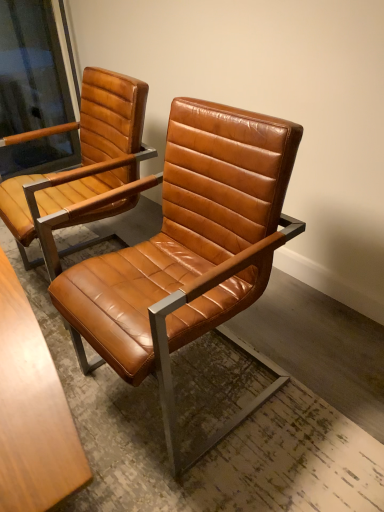
Locate an element on the screen. This screenshot has height=512, width=384. matte brown leather chair arm at upper left is located at coordinates (31, 69).

What is the approximate height of cognac leather chair at center, which is counted as the 1th chair, starting from the left?

cognac leather chair at center, which is counted as the 1th chair, starting from the left, is 34.24 inches tall.

Identify the location of cognac leather chair at center, positioned as the second chair in right-to-left order. This screenshot has height=512, width=384. (81, 155).

This screenshot has height=512, width=384. Describe the element at coordinates (188, 248) in the screenshot. I see `cognac leather chair at center, which is counted as the 2th chair, starting from the left` at that location.

What are the coordinates of `matte brown leather chair arm at upper left` in the screenshot? It's located at (31, 69).

Between point (109, 320) and point (11, 19), which one is positioned behind?

Positioned behind is point (11, 19).

In terms of height, does cognac leather chair at center, which is counted as the 2th chair, starting from the left, look taller or shorter compared to matte brown leather chair arm at upper left?

cognac leather chair at center, which is counted as the 2th chair, starting from the left, is taller than matte brown leather chair arm at upper left.

Relative to matte brown leather chair arm at upper left, is cognac leather chair at center, positioned as the first chair in right-to-left order, in front or behind?

Visually, cognac leather chair at center, positioned as the first chair in right-to-left order, is located in front of matte brown leather chair arm at upper left.

Which is more to the left, cognac leather chair at center, positioned as the first chair in right-to-left order, or matte brown leather chair arm at upper left?

matte brown leather chair arm at upper left.

From a real-world perspective, is matte brown leather chair arm at upper left positioned above or below cognac leather chair at center, positioned as the first chair in right-to-left order?

In terms of real-world spatial position, matte brown leather chair arm at upper left is above cognac leather chair at center, positioned as the first chair in right-to-left order.

Is matte brown leather chair arm at upper left facing towards cognac leather chair at center, which is counted as the 2th chair, starting from the left?

No, matte brown leather chair arm at upper left is not facing towards cognac leather chair at center, which is counted as the 2th chair, starting from the left.

At what (x,y) coordinates should I click in order to perform the action: click on the 2nd chair counting from the right side of the matte brown leather chair arm at upper left. Please return your answer as a coordinate pair (x, y). The width and height of the screenshot is (384, 512). Looking at the image, I should click on (188, 248).

Locate an element on the screen. This screenshot has width=384, height=512. window screen that is behind the cognac leather chair at center, positioned as the second chair in right-to-left order is located at coordinates (31, 69).

How many degrees apart are the facing directions of matte brown leather chair arm at upper left and cognac leather chair at center, positioned as the second chair in right-to-left order?

The angular difference between matte brown leather chair arm at upper left and cognac leather chair at center, positioned as the second chair in right-to-left order, is 4.02 degrees.

Is cognac leather chair at center, which is counted as the 1th chair, starting from the left, at the back of matte brown leather chair arm at upper left?

matte brown leather chair arm at upper left does not have its back to cognac leather chair at center, which is counted as the 1th chair, starting from the left.

Which object is positioned more to the left, matte brown leather chair arm at upper left or cognac leather chair at center, positioned as the second chair in right-to-left order?

Positioned to the left is matte brown leather chair arm at upper left.

In the scene shown: Could you tell me if cognac leather chair at center, which is counted as the 1th chair, starting from the left, is turned towards matte brown leather chair arm at upper left?

No.

Is cognac leather chair at center, which is counted as the 1th chair, starting from the left, wider or thinner than matte brown leather chair arm at upper left?

Clearly, cognac leather chair at center, which is counted as the 1th chair, starting from the left, has more width compared to matte brown leather chair arm at upper left.

From the image's perspective, is cognac leather chair at center, which is counted as the 1th chair, starting from the left, located above or below matte brown leather chair arm at upper left?

From the image's perspective, cognac leather chair at center, which is counted as the 1th chair, starting from the left, appears below matte brown leather chair arm at upper left.

Between cognac leather chair at center, which is counted as the 1th chair, starting from the left, and matte brown leather chair arm at upper left, which one appears on the right side from the viewer's perspective?

cognac leather chair at center, which is counted as the 1th chair, starting from the left.

Choose the correct answer: Is cognac leather chair at center, positioned as the first chair in right-to-left order, inside cognac leather chair at center, which is counted as the 1th chair, starting from the left, or outside it?

cognac leather chair at center, positioned as the first chair in right-to-left order, cannot be found inside cognac leather chair at center, which is counted as the 1th chair, starting from the left.

Is cognac leather chair at center, positioned as the first chair in right-to-left order, in front of or behind cognac leather chair at center, which is counted as the 1th chair, starting from the left, in the image?

Visually, cognac leather chair at center, positioned as the first chair in right-to-left order, is located in front of cognac leather chair at center, which is counted as the 1th chair, starting from the left.

Are cognac leather chair at center, which is counted as the 2th chair, starting from the left, and cognac leather chair at center, positioned as the second chair in right-to-left order, far apart?

No, cognac leather chair at center, which is counted as the 2th chair, starting from the left, is in close proximity to cognac leather chair at center, positioned as the second chair in right-to-left order.

What's the angular difference between cognac leather chair at center, which is counted as the 2th chair, starting from the left, and cognac leather chair at center, positioned as the second chair in right-to-left order,'s facing directions?

cognac leather chair at center, which is counted as the 2th chair, starting from the left, and cognac leather chair at center, positioned as the second chair in right-to-left order, are facing 4.02 degrees away from each other.

Is cognac leather chair at center, which is counted as the 1th chair, starting from the left, outside of cognac leather chair at center, which is counted as the 2th chair, starting from the left?

Yes, cognac leather chair at center, which is counted as the 1th chair, starting from the left, is outside of cognac leather chair at center, which is counted as the 2th chair, starting from the left.

Does point (122, 136) appear closer or farther from the camera than point (166, 151)?

Point (122, 136) is positioned farther from the camera compared to point (166, 151).

Considering the sizes of cognac leather chair at center, which is counted as the 1th chair, starting from the left, and cognac leather chair at center, which is counted as the 2th chair, starting from the left, in the image, is cognac leather chair at center, which is counted as the 1th chair, starting from the left, wider or thinner than cognac leather chair at center, which is counted as the 2th chair, starting from the left,?

cognac leather chair at center, which is counted as the 1th chair, starting from the left, is thinner than cognac leather chair at center, which is counted as the 2th chair, starting from the left.

Who is taller, cognac leather chair at center, positioned as the second chair in right-to-left order, or cognac leather chair at center, which is counted as the 2th chair, starting from the left?

cognac leather chair at center, which is counted as the 2th chair, starting from the left, is taller.

From a real-world perspective, starting from the matte brown leather chair arm at upper left, which chair is the 1st one below it? Please provide its 2D coordinates.

[(188, 248)]

At what (x,y) coordinates should I click in order to perform the action: click on window screen on the left of cognac leather chair at center, which is counted as the 2th chair, starting from the left. Please return your answer as a coordinate pair (x, y). Looking at the image, I should click on (31, 69).

Considering their positions, is cognac leather chair at center, which is counted as the 2th chair, starting from the left, positioned further to matte brown leather chair arm at upper left than cognac leather chair at center, positioned as the second chair in right-to-left order?

cognac leather chair at center, which is counted as the 2th chair, starting from the left, is further to matte brown leather chair arm at upper left.

When comparing their distances from cognac leather chair at center, positioned as the first chair in right-to-left order, does matte brown leather chair arm at upper left or cognac leather chair at center, which is counted as the 1th chair, starting from the left, seem closer?

Based on the image, cognac leather chair at center, which is counted as the 1th chair, starting from the left, appears to be nearer to cognac leather chair at center, positioned as the first chair in right-to-left order.

When comparing their distances from matte brown leather chair arm at upper left, does cognac leather chair at center, which is counted as the 1th chair, starting from the left, or cognac leather chair at center, positioned as the first chair in right-to-left order, seem closer?

The object closer to matte brown leather chair arm at upper left is cognac leather chair at center, which is counted as the 1th chair, starting from the left.

Based on the photo, based on their spatial positions, is cognac leather chair at center, which is counted as the 2th chair, starting from the left, or matte brown leather chair arm at upper left closer to cognac leather chair at center, which is counted as the 1th chair, starting from the left?

cognac leather chair at center, which is counted as the 2th chair, starting from the left.

Considering their positions, is cognac leather chair at center, positioned as the second chair in right-to-left order, positioned closer to cognac leather chair at center, positioned as the first chair in right-to-left order, than matte brown leather chair arm at upper left?

Among the two, cognac leather chair at center, positioned as the second chair in right-to-left order, is located nearer to cognac leather chair at center, positioned as the first chair in right-to-left order.

Considering their positions, is matte brown leather chair arm at upper left positioned further to cognac leather chair at center, which is counted as the 1th chair, starting from the left, than cognac leather chair at center, which is counted as the 2th chair, starting from the left?

matte brown leather chair arm at upper left lies further to cognac leather chair at center, which is counted as the 1th chair, starting from the left, than the other object.

You are a GUI agent. You are given a task and a screenshot of the screen. Output one action in this format:
    pyautogui.click(x=<x>, y=<y>)
    Task: Click on the chair positioned between cognac leather chair at center, positioned as the first chair in right-to-left order, and matte brown leather chair arm at upper left from near to far
    
    Given the screenshot: What is the action you would take?
    pyautogui.click(x=81, y=155)